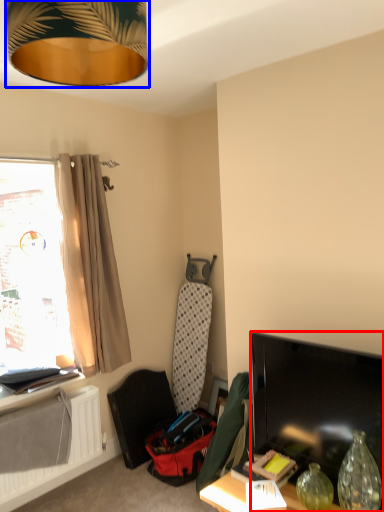
Question: Which of the following is the farthest to the observer, television (highlighted by a red box) or lamp (highlighted by a blue box)?

Choices:
 (A) television
 (B) lamp

Answer: (A)